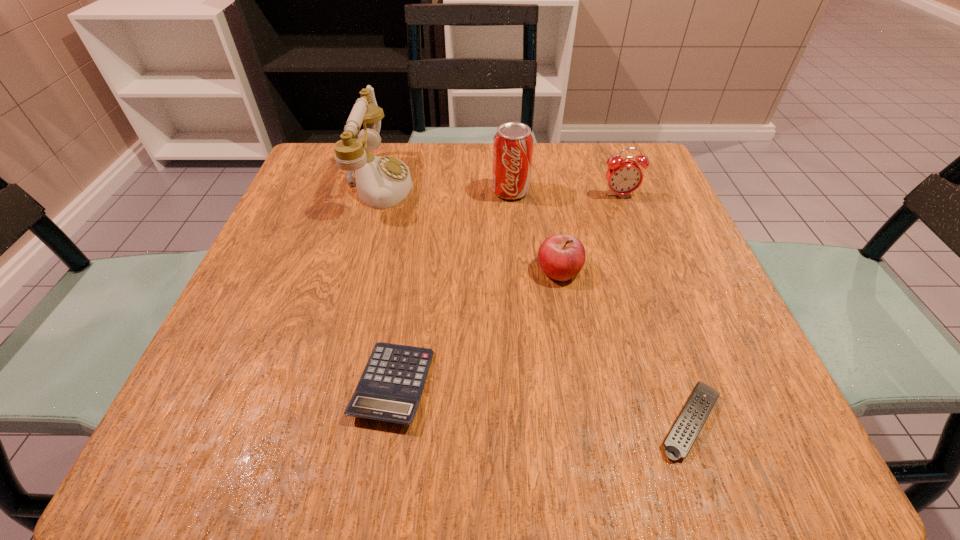
The width and height of the screenshot is (960, 540). In order to click on vacant area that satisfies the following two spatial constraints: 1. on the dial of the third nearest object; 2. on the right side of the telephone in this screenshot , I will do `click(355, 270)`.

You are a GUI agent. You are given a task and a screenshot of the screen. Output one action in this format:
    pyautogui.click(x=<x>, y=<y>)
    Task: Click on the free location that satisfies the following two spatial constraints: 1. on the dial of the telephone; 2. on the back side of the calculator
    This screenshot has width=960, height=540.
    Given the screenshot: What is the action you would take?
    pyautogui.click(x=323, y=384)

Where is `free spot that satisfies the following two spatial constraints: 1. on the dial of the tallest object; 2. on the back side of the fifth tallest object`? The width and height of the screenshot is (960, 540). free spot that satisfies the following two spatial constraints: 1. on the dial of the tallest object; 2. on the back side of the fifth tallest object is located at coordinates (323, 384).